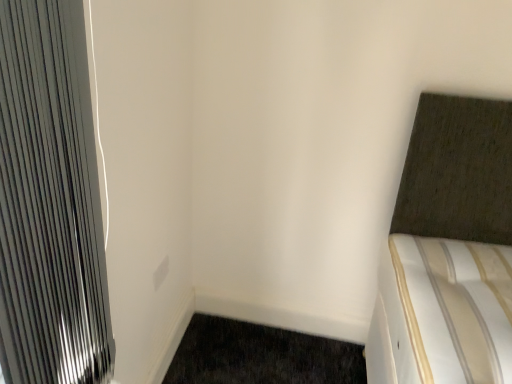
Question: Is dark brown carpet at lower left taller than metallic silver radiator at left?

Choices:
 (A) no
 (B) yes

Answer: (A)

Question: From the image's perspective, does dark brown carpet at lower left appear higher than metallic silver radiator at left?

Choices:
 (A) yes
 (B) no

Answer: (B)

Question: From the image's perspective, is dark brown carpet at lower left under metallic silver radiator at left?

Choices:
 (A) no
 (B) yes

Answer: (B)

Question: Is dark brown carpet at lower left thinner than metallic silver radiator at left?

Choices:
 (A) no
 (B) yes

Answer: (A)

Question: Is dark brown carpet at lower left facing away from metallic silver radiator at left?

Choices:
 (A) yes
 (B) no

Answer: (B)

Question: In terms of height, does dark brown carpet at lower left look taller or shorter compared to white matte electric outlet at center?

Choices:
 (A) short
 (B) tall

Answer: (A)

Question: Is dark brown carpet at lower left bigger or smaller than white matte electric outlet at center?

Choices:
 (A) small
 (B) big

Answer: (B)

Question: In the image, is dark brown carpet at lower left on the left side or the right side of white matte electric outlet at center?

Choices:
 (A) right
 (B) left

Answer: (A)

Question: From the image's perspective, is dark brown carpet at lower left located above or below white matte electric outlet at center?

Choices:
 (A) above
 (B) below

Answer: (B)

Question: From a real-world perspective, is metallic silver radiator at left positioned above or below white matte electric outlet at center?

Choices:
 (A) below
 (B) above

Answer: (B)

Question: In terms of size, does metallic silver radiator at left appear bigger or smaller than white matte electric outlet at center?

Choices:
 (A) small
 (B) big

Answer: (B)

Question: Would you say metallic silver radiator at left is to the left or to the right of white matte electric outlet at center in the picture?

Choices:
 (A) right
 (B) left

Answer: (A)

Question: From the image's perspective, relative to white matte electric outlet at center, is metallic silver radiator at left above or below?

Choices:
 (A) below
 (B) above

Answer: (B)

Question: In terms of width, does dark brown carpet at lower left look wider or thinner when compared to metallic silver radiator at left?

Choices:
 (A) wide
 (B) thin

Answer: (A)

Question: From a real-world perspective, is dark brown carpet at lower left positioned above or below metallic silver radiator at left?

Choices:
 (A) above
 (B) below

Answer: (B)